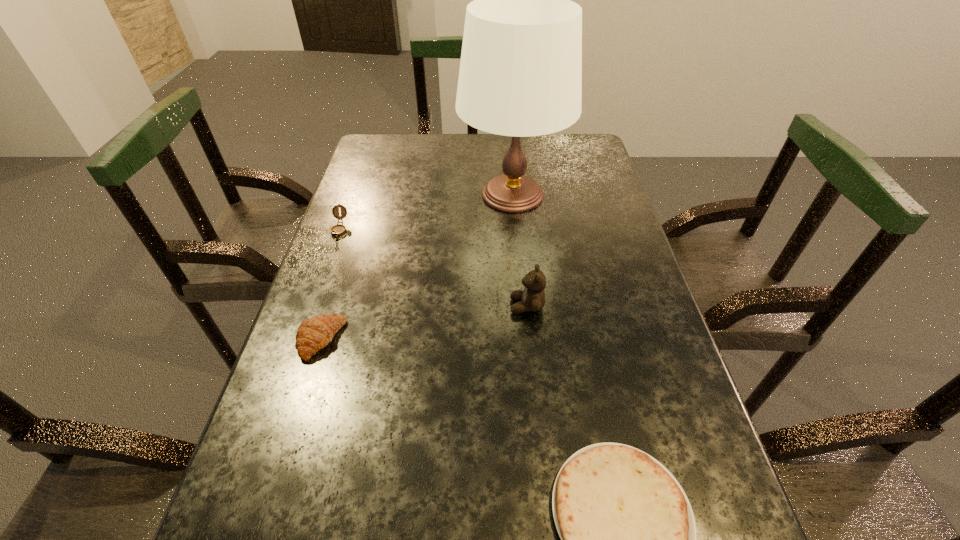
Locate an element on the screen. The width and height of the screenshot is (960, 540). object that is at the far edge is located at coordinates [520, 75].

You are a GUI agent. You are given a task and a screenshot of the screen. Output one action in this format:
    pyautogui.click(x=<x>, y=<y>)
    Task: Click on the compass at the left edge
    This screenshot has height=540, width=960.
    Given the screenshot: What is the action you would take?
    pyautogui.click(x=338, y=230)

What are the coordinates of `crescent roll located in the left edge section of the desktop` in the screenshot? It's located at (313, 334).

Identify the location of object located at the right edge. (520, 75).

Image resolution: width=960 pixels, height=540 pixels. What are the coordinates of `object positioned at the far right corner` in the screenshot? It's located at (520, 75).

Locate an element on the screen. This screenshot has width=960, height=540. vacant space at the far edge is located at coordinates (527, 142).

Where is `vacant space at the left edge`? The height and width of the screenshot is (540, 960). vacant space at the left edge is located at coordinates (376, 325).

In the image, there is a desktop. In order to click on free space at the right edge in this screenshot , I will do `click(715, 505)`.

Locate an element on the screen. free spot between the lamp and the crescent roll is located at coordinates (417, 267).

The height and width of the screenshot is (540, 960). In order to click on vacant area between the crescent roll and the tallest object in this screenshot , I will do `click(417, 267)`.